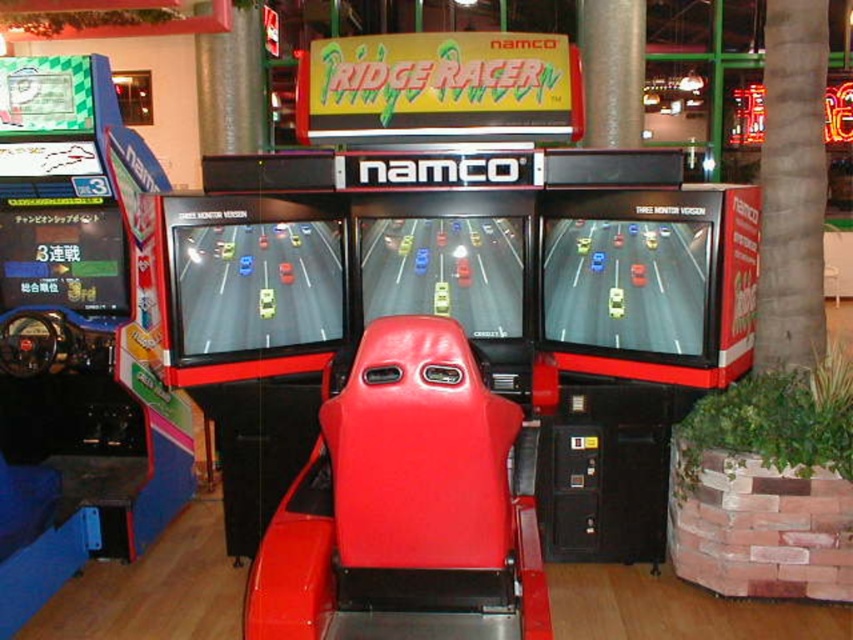
Question: Which of these objects is positioned closest to the gray textured pillar at center right?

Choices:
 (A) shiny plastic screen at center
 (B) shiny plastic arcade machine at center
 (C) shiny plastic car seat at center

Answer: (A)

Question: From the image, what is the correct spatial relationship of gray textured pillar at center right in relation to shiny plastic screen at center?

Choices:
 (A) right
 (B) left

Answer: (A)

Question: Which of the following is the farthest from the observer?

Choices:
 (A) (697, 237)
 (B) (402, 275)
 (C) (824, 33)

Answer: (B)

Question: Considering the real-world distances, which object is farthest from the shiny plastic car seat at center?

Choices:
 (A) gray textured pillar at center right
 (B) shiny plastic screen at center

Answer: (A)

Question: Does shiny plastic arcade machine at center appear on the left side of shiny plastic car seat at center?

Choices:
 (A) no
 (B) yes

Answer: (B)

Question: Can you confirm if shiny plastic arcade machine at center is bigger than shiny plastic car seat at center?

Choices:
 (A) no
 (B) yes

Answer: (B)